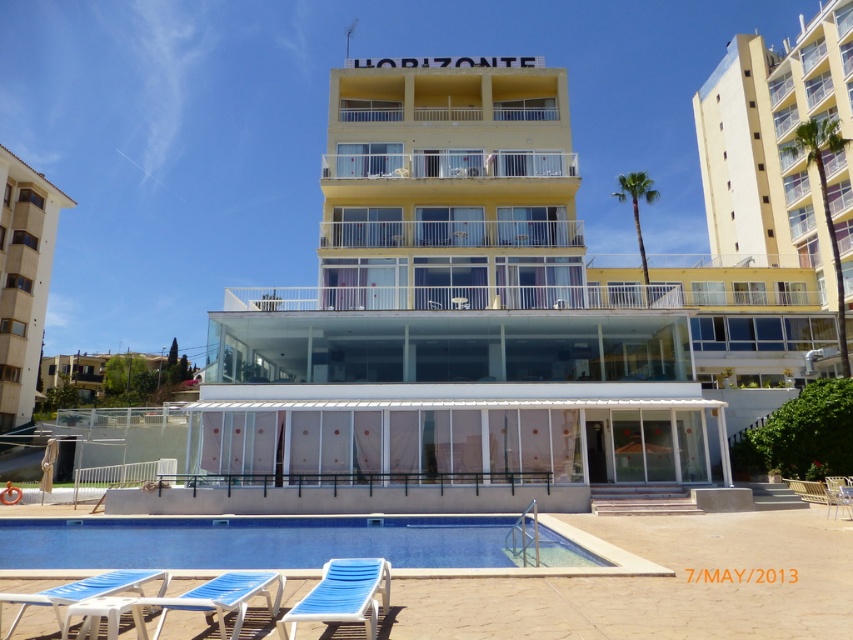
You are standing at the edge of the swimming pool and want to reach the blue plastic beach chair at lower left without walking on the grass. Which direction should you move relative to the yellow matte building at center?

You should move to the left relative to the yellow matte building at center because the blue plastic beach chair at lower left is positioned to the left of the building.

You are standing at the base of the multi story building and want to take a photo of the sign reading HORIZONTE. There are two points marked on the ground in front of you at coordinates point (718,412) and point (88,596). Which point should you stand at to ensure the sign is fully visible without any obstruction?

You should stand at point (88,596) because point (718,412) is behind it, so standing at the forward point will give a clearer view of the HORIZONTE sign.

You are standing at the edge of the swimming pool and want to sit down. Which chair, the blue fabric lounge chair at lower left or the blue plastic beach chair at lower left, is closer to you?

The blue fabric lounge chair at lower left is closer to the viewer than the blue plastic beach chair at lower left, so the blue fabric lounge chair at lower left is closer to you.